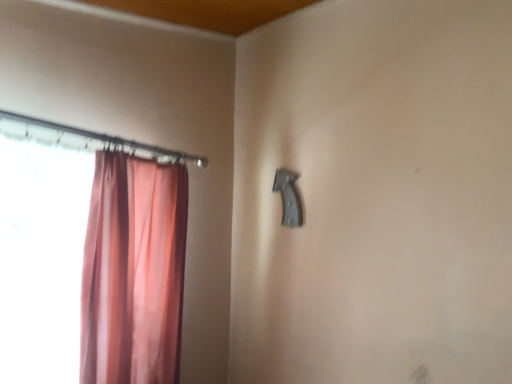
This screenshot has width=512, height=384. Find the location of `matte black door handle at upper center`. matte black door handle at upper center is located at coordinates (288, 197).

The width and height of the screenshot is (512, 384). What do you see at coordinates (288, 197) in the screenshot?
I see `matte black door handle at upper center` at bounding box center [288, 197].

The height and width of the screenshot is (384, 512). What are the coordinates of `pink sheer curtain at left` in the screenshot? It's located at (93, 257).

Describe the element at coordinates (93, 257) in the screenshot. The image size is (512, 384). I see `pink sheer curtain at left` at that location.

In order to face pink sheer curtain at left, should I rotate leftwards or rightwards?

It's best to rotate left around 19.122 degrees.

You are a GUI agent. You are given a task and a screenshot of the screen. Output one action in this format:
    pyautogui.click(x=<x>, y=<y>)
    Task: Click on the matte black door handle at upper center
    This screenshot has width=512, height=384.
    Given the screenshot: What is the action you would take?
    pyautogui.click(x=288, y=197)

Does pink sheer curtain at left appear on the left side of matte black door handle at upper center?

Correct, you'll find pink sheer curtain at left to the left of matte black door handle at upper center.

In the scene shown: Does pink sheer curtain at left come behind matte black door handle at upper center?

That is False.

Which is farther, (x=90, y=215) or (x=293, y=180)?

The point (x=293, y=180) is behind.

From the image's perspective, is pink sheer curtain at left located above or below matte black door handle at upper center?

Clearly, from the image's perspective, pink sheer curtain at left is below matte black door handle at upper center.

From a real-world perspective, which object stands above the other?

From a 3D spatial view, matte black door handle at upper center is above.

Considering the relative sizes of pink sheer curtain at left and matte black door handle at upper center in the image provided, is pink sheer curtain at left thinner than matte black door handle at upper center?

No, pink sheer curtain at left is not thinner than matte black door handle at upper center.

Between pink sheer curtain at left and matte black door handle at upper center, which one has more height?

pink sheer curtain at left is taller.

Can you confirm if pink sheer curtain at left is smaller than matte black door handle at upper center?

No.

Is pink sheer curtain at left not inside matte black door handle at upper center?

Absolutely, pink sheer curtain at left is external to matte black door handle at upper center.

Are pink sheer curtain at left and matte black door handle at upper center located far from each other?

That's not correct — pink sheer curtain at left is a little close to matte black door handle at upper center.

Is pink sheer curtain at left positioned with its back to matte black door handle at upper center?

No, pink sheer curtain at left is not facing away from matte black door handle at upper center.

Can you tell me how much pink sheer curtain at left and matte black door handle at upper center differ in facing direction?

pink sheer curtain at left and matte black door handle at upper center are facing 92.5 degrees away from each other.

How far apart are pink sheer curtain at left and matte black door handle at upper center?

36.60 inches.

This screenshot has width=512, height=384. In order to click on curtain on the left of matte black door handle at upper center in this screenshot , I will do `click(93, 257)`.

Consider the image. Considering the relative positions of matte black door handle at upper center and pink sheer curtain at left in the image provided, is matte black door handle at upper center to the left or to the right of pink sheer curtain at left?

Clearly, matte black door handle at upper center is on the right of pink sheer curtain at left in the image.

From the picture: Is the position of matte black door handle at upper center less distant than that of pink sheer curtain at left?

No, it is behind pink sheer curtain at left.

Which is closer, (289, 183) or (120, 357)?

Point (289, 183).

From the image's perspective, relative to pink sheer curtain at left, is matte black door handle at upper center above or below?

From the image's perspective, matte black door handle at upper center appears above pink sheer curtain at left.

From a real-world perspective, which is physically below, matte black door handle at upper center or pink sheer curtain at left?

In real-world perspective, pink sheer curtain at left is lower.

Which object is wider, matte black door handle at upper center or pink sheer curtain at left?

With larger width is pink sheer curtain at left.

Is matte black door handle at upper center shorter than pink sheer curtain at left?

Indeed, matte black door handle at upper center has a lesser height compared to pink sheer curtain at left.

Can you confirm if matte black door handle at upper center is smaller than pink sheer curtain at left?

Indeed, matte black door handle at upper center has a smaller size compared to pink sheer curtain at left.

Based on the photo, would you say matte black door handle at upper center contains pink sheer curtain at left?

Actually, pink sheer curtain at left is outside matte black door handle at upper center.

Is the surface of matte black door handle at upper center in direct contact with pink sheer curtain at left?

No, matte black door handle at upper center is not next to pink sheer curtain at left.

Could you tell me if matte black door handle at upper center is turned towards pink sheer curtain at left?

Yes, matte black door handle at upper center is turned towards pink sheer curtain at left.

In the image, there is a matte black door handle at upper center. Where is `curtain below it (from a real-world perspective)`? The height and width of the screenshot is (384, 512). curtain below it (from a real-world perspective) is located at coordinates (93, 257).

I want to click on door handle behind the pink sheer curtain at left, so click(x=288, y=197).

Locate an element on the screen. The height and width of the screenshot is (384, 512). door handle lying above the pink sheer curtain at left (from the image's perspective) is located at coordinates (288, 197).